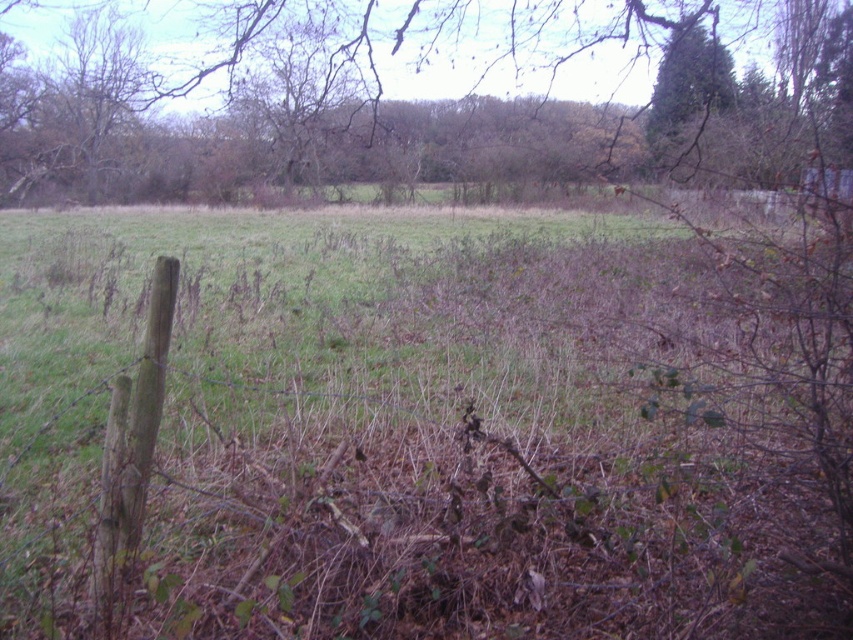
Question: Which point is closer to the camera taking this photo?

Choices:
 (A) (691, 104)
 (B) (171, 38)

Answer: (A)

Question: Can you confirm if brown leafy tree at upper center is positioned to the right of green textured tree at upper right?

Choices:
 (A) yes
 (B) no

Answer: (B)

Question: Which of the following is the farthest from the observer?

Choices:
 (A) green textured tree at upper right
 (B) brown leafy tree at upper center

Answer: (A)

Question: Which object is closer to the camera taking this photo?

Choices:
 (A) brown leafy tree at upper center
 (B) green textured tree at upper right

Answer: (A)

Question: Can you confirm if brown leafy tree at upper center is thinner than green textured tree at upper right?

Choices:
 (A) no
 (B) yes

Answer: (A)

Question: Is brown leafy tree at upper center above green textured tree at upper right?

Choices:
 (A) yes
 (B) no

Answer: (A)